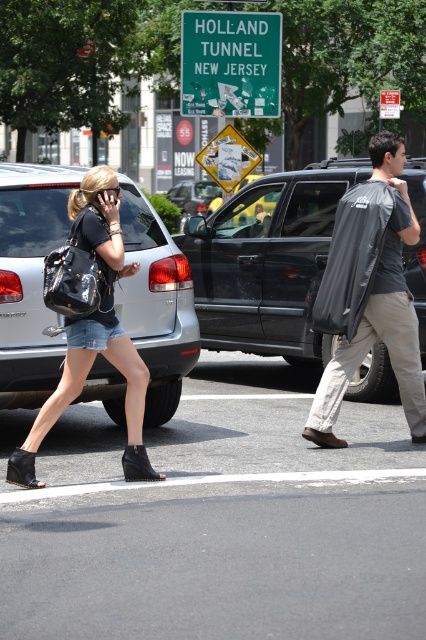
Can you confirm if dark gray fabric bag at center is thinner than green matte sign at upper center?

Yes, dark gray fabric bag at center is thinner than green matte sign at upper center.

Does dark gray fabric bag at center appear under green matte sign at upper center?

Indeed, dark gray fabric bag at center is positioned under green matte sign at upper center.

Is point (382, 184) farther from viewer compared to point (265, 61)?

No, (382, 184) is closer to viewer.

This screenshot has height=640, width=426. Identify the location of dark gray fabric bag at center. (370, 292).

Which is in front, point (68, 259) or point (181, 84)?

Positioned in front is point (68, 259).

Find the location of a particular element. The image size is (426, 640). denim shorts at center is located at coordinates (89, 324).

Image resolution: width=426 pixels, height=640 pixels. In order to click on denim shorts at center in this screenshot , I will do `click(89, 324)`.

Image resolution: width=426 pixels, height=640 pixels. What are the coordinates of `denim shorts at center` in the screenshot? It's located at (89, 324).

Identify the location of matte black suv at center. This screenshot has width=426, height=640. (267, 260).

Does matte black suv at center have a greater height compared to dark gray fabric bag at center?

No, matte black suv at center is not taller than dark gray fabric bag at center.

Is point (325, 216) positioned after point (393, 253)?

Yes, it is.

Find the location of a particular element. The image size is (426, 640). matte black suv at center is located at coordinates (267, 260).